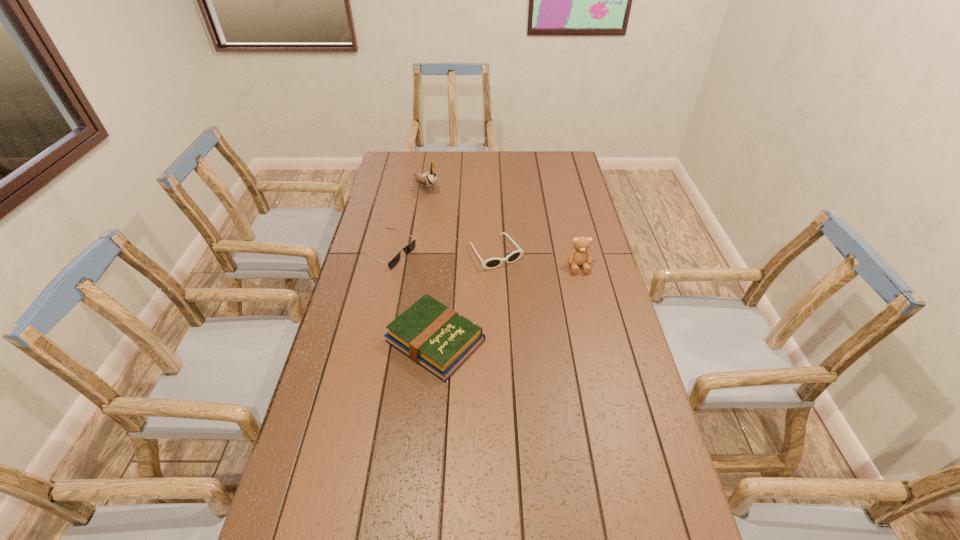
Where is `the nearest object`? This screenshot has height=540, width=960. the nearest object is located at coordinates (438, 338).

In order to click on the third tallest object in this screenshot , I will do `click(438, 338)`.

Locate an element on the screen. The image size is (960, 540). the rightmost object is located at coordinates (580, 256).

The width and height of the screenshot is (960, 540). In order to click on teddy bear in this screenshot , I will do `click(580, 256)`.

The width and height of the screenshot is (960, 540). Find the location of `the tallest object`. the tallest object is located at coordinates pos(429,179).

Identify the location of the farthest object. The image size is (960, 540). (429, 179).

You are a GUI agent. You are given a task and a screenshot of the screen. Output one action in this format:
    pyautogui.click(x=<x>, y=<y>)
    Task: Click on the left sunglasses
    The width and height of the screenshot is (960, 540).
    Given the screenshot: What is the action you would take?
    coord(410,247)

This screenshot has height=540, width=960. I want to click on the right sunglasses, so click(491, 263).

At what (x,y) coordinates should I click in order to perform the action: click on vacant space located on the left of the third tallest object. Please return your answer as a coordinate pair (x, y). Image resolution: width=960 pixels, height=540 pixels. Looking at the image, I should click on (362, 341).

Where is `vacant space located on the face of the rightmost object`? vacant space located on the face of the rightmost object is located at coordinates pos(588,307).